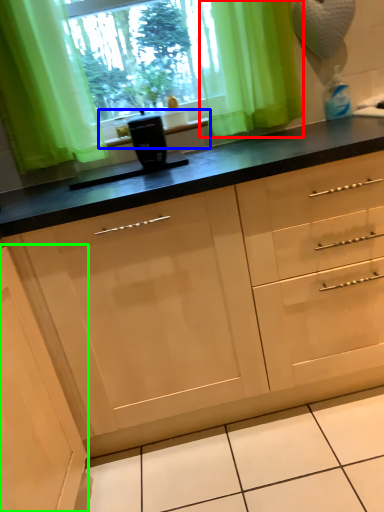
Question: Estimate the real-world distances between objects in this image. Which object is farther from curtain (highlighted by a red box), window sill (highlighted by a blue box) or cabinetry (highlighted by a green box)?

Choices:
 (A) window sill
 (B) cabinetry

Answer: (B)